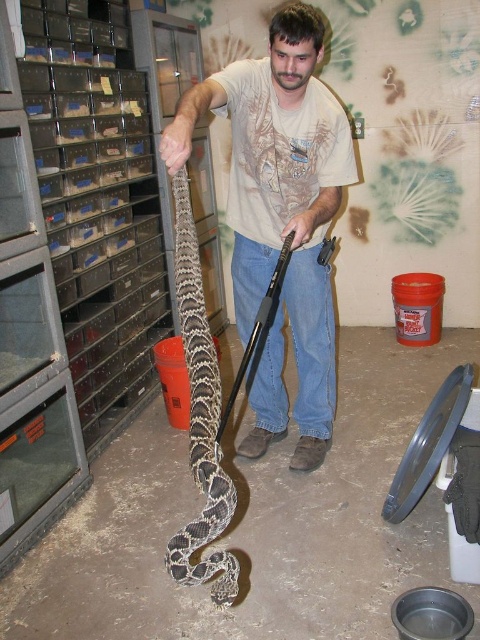
Between light brown cotton t-shirt at center and patterned scales snake at center, which one appears on the right side from the viewer's perspective?

light brown cotton t-shirt at center is more to the right.

Which is in front, point (305, 56) or point (188, 273)?

Positioned in front is point (188, 273).

I want to click on light brown cotton t-shirt at center, so click(280, 216).